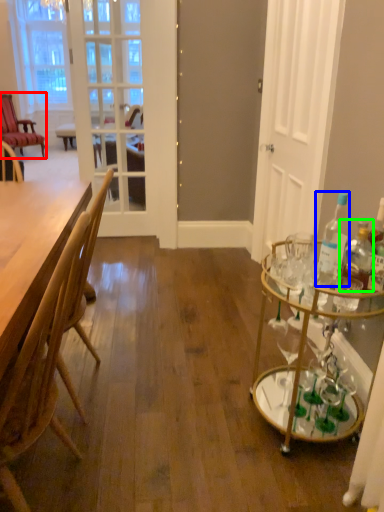
Question: Estimate the real-world distances between objects in this image. Which object is farther from chair (highlighted by a red box), bottle (highlighted by a blue box) or bottle (highlighted by a green box)?

Choices:
 (A) bottle
 (B) bottle

Answer: (B)